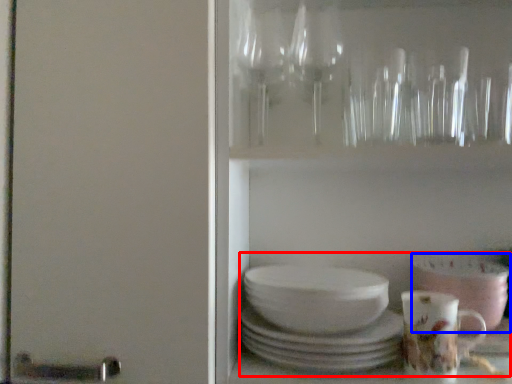
Question: Which of the following is the closest to the observer, tea set (highlighted by a red box) or bowl (highlighted by a blue box)?

Choices:
 (A) tea set
 (B) bowl

Answer: (A)